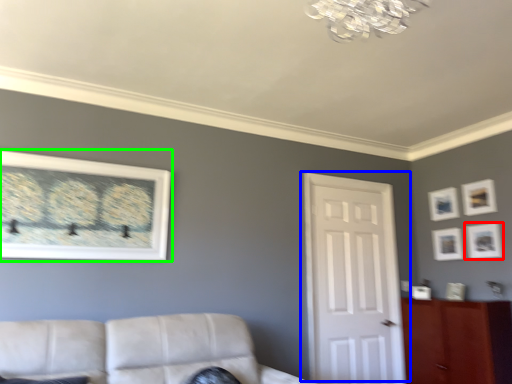
Question: Which is nearer to the picture frame (highlighted by a red box)? door (highlighted by a blue box) or picture frame (highlighted by a green box).

Choices:
 (A) door
 (B) picture frame

Answer: (A)